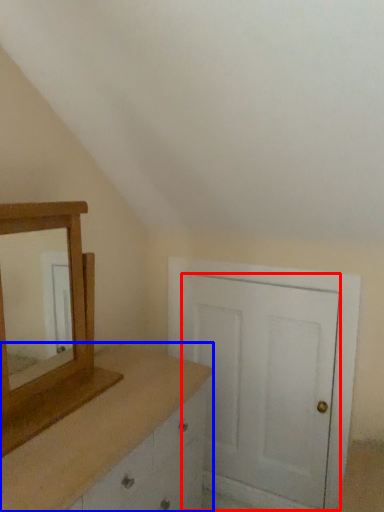
Question: Which of the following is the farthest to the observer, door (highlighted by a red box) or chest of drawers (highlighted by a blue box)?

Choices:
 (A) door
 (B) chest of drawers

Answer: (A)